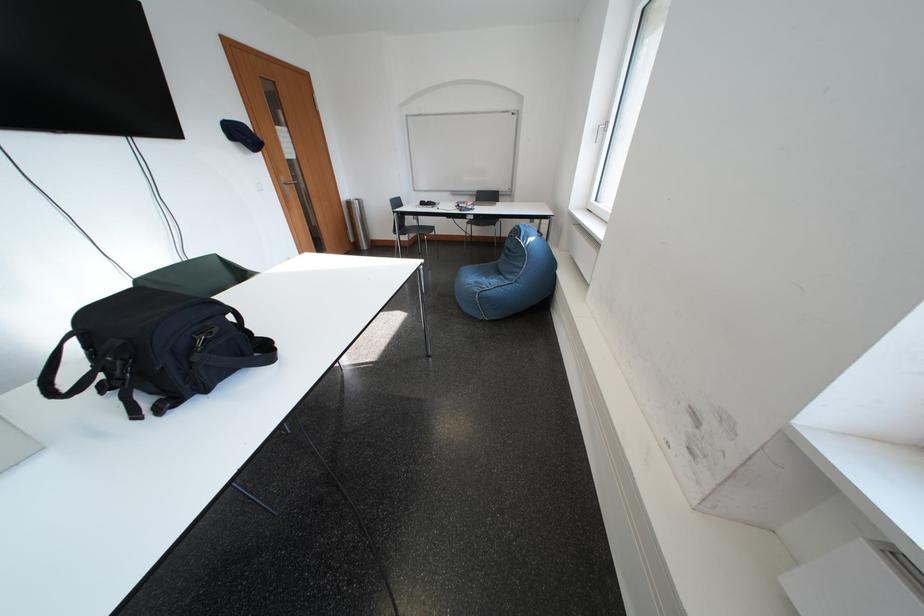
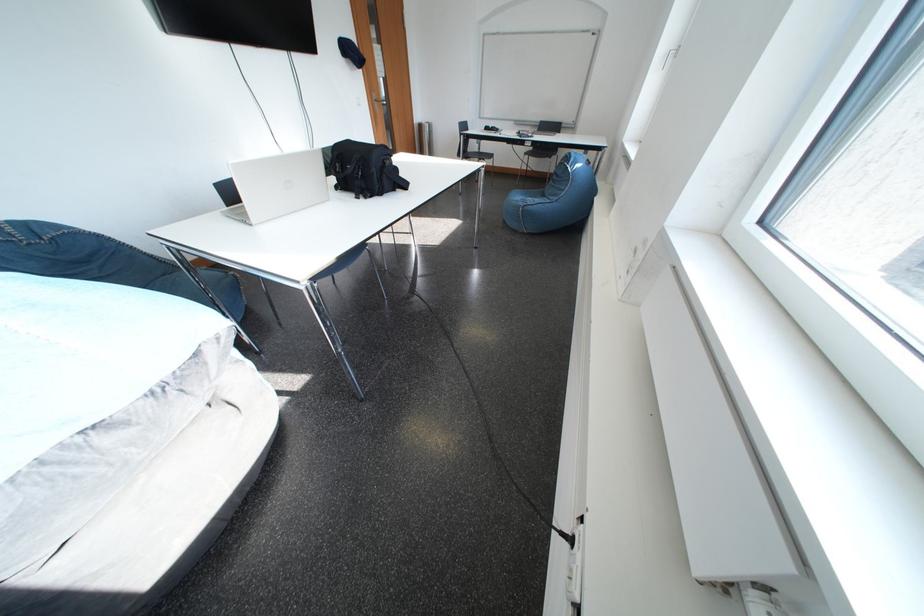
Question: The images are taken continuously from a first-person perspective. In which direction is your viewpoint rotating?

Choices:
 (A) Left
 (B) Right
 (C) Up
 (D) Down

Answer: (D)